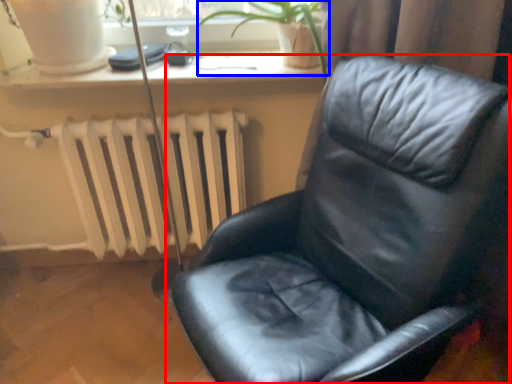
Question: Which of the following is the closest to the observer, chair (highlighted by a red box) or plant (highlighted by a blue box)?

Choices:
 (A) chair
 (B) plant

Answer: (A)